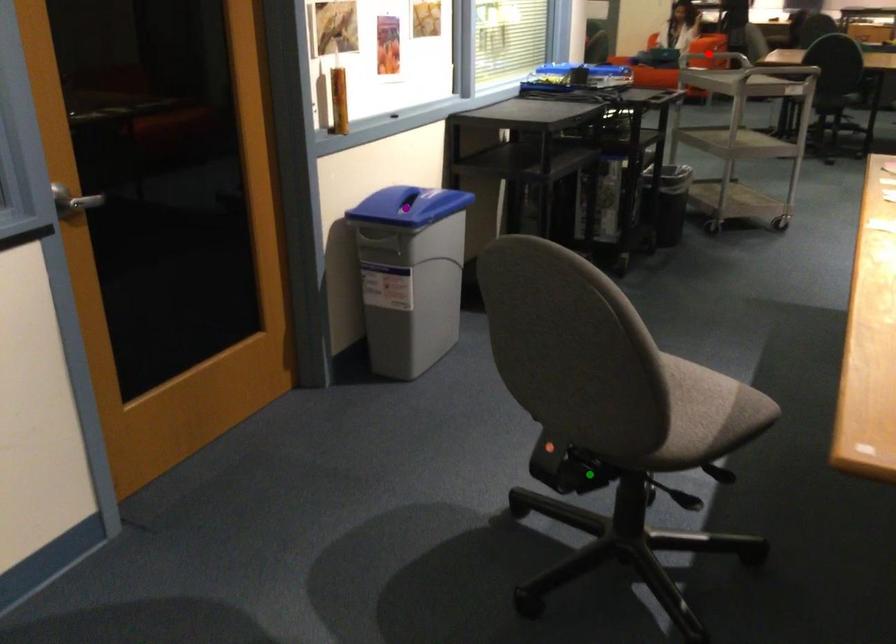
Order these from nearest to farthest:
purple point | green point | red point

green point, purple point, red point